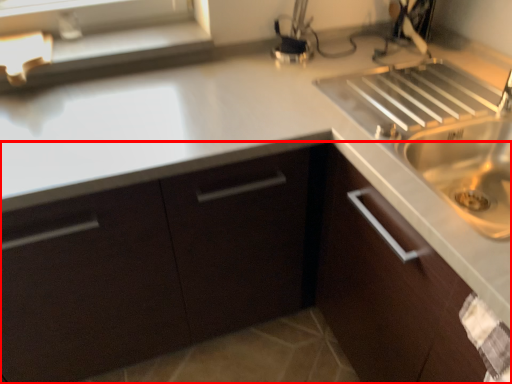
Question: In this image, where is cabinetry (annotated by the red box) located relative to window sill?

Choices:
 (A) right
 (B) left

Answer: (A)